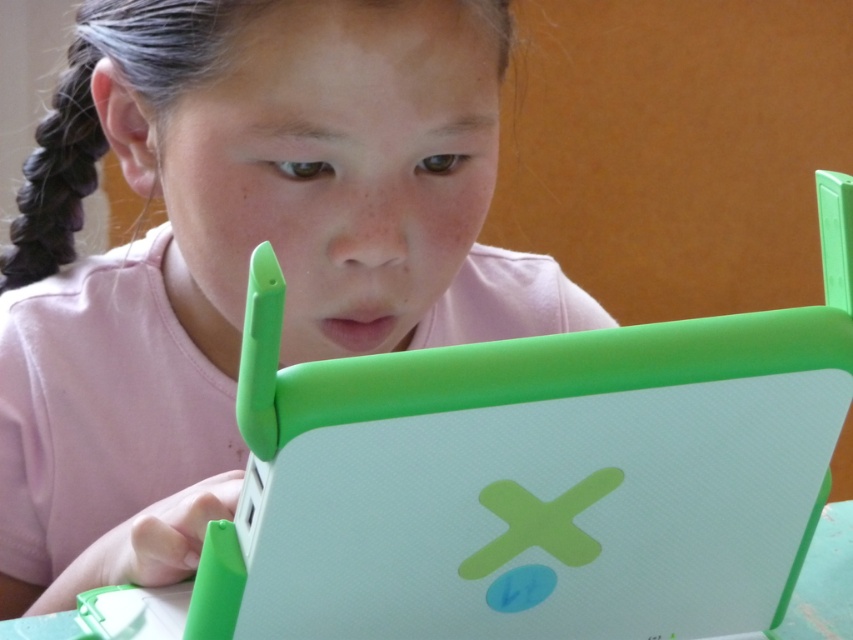
Based on the photo, you are a photographer setting up for a school photo. You need to ensure that the pink matte shirt at center and the white matte table at lower center are both in frame. Based on their positions and sizes, which object should you adjust your camera angle to prioritize capturing first?

The pink matte shirt at center might be wider than white matte table at lower center, so you should prioritize capturing the pink matte shirt at center first to ensure it fits within the frame.

You are an interior designer assessing the layout of this room. The pink matte shirt at center and the white matte table at lower center are both in your view. Which object appears taller in the image?

The pink matte shirt at center is taller than the white matte table at lower center according to the description.